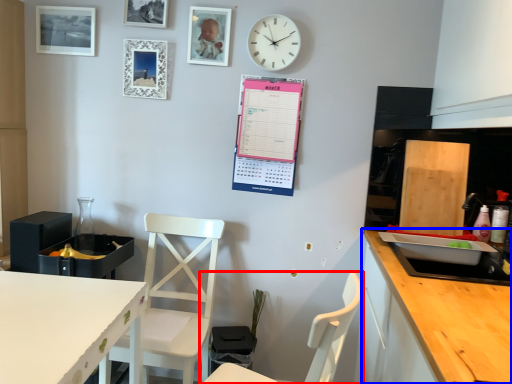
Question: Which of the following is the closest to the observer, chair (highlighted by a red box) or cabinetry (highlighted by a blue box)?

Choices:
 (A) chair
 (B) cabinetry

Answer: (A)